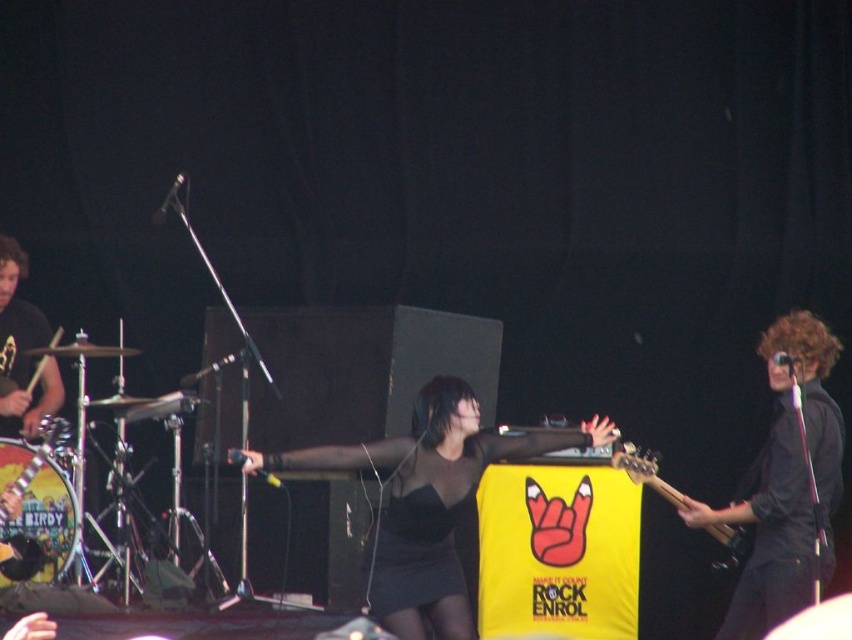
Is point (36, 513) positioned in front of point (717, 540)?

Yes, point (36, 513) is in front of point (717, 540).

Is brushed metal drum at lower left wider than wooden electric guitar at center?

In fact, brushed metal drum at lower left might be narrower than wooden electric guitar at center.

Between point (22, 456) and point (625, 460), which one is positioned behind?

The point (22, 456) is behind.

Identify the location of brushed metal drum at lower left. The image size is (852, 640). (49, 515).

Where is `brushed metal drumsticks at left`? The image size is (852, 640). brushed metal drumsticks at left is located at coordinates (22, 349).

Does brushed metal drumsticks at left have a larger size compared to wooden electric guitar at center?

Indeed, brushed metal drumsticks at left has a larger size compared to wooden electric guitar at center.

Is point (9, 307) positioned after point (746, 545)?

Yes, it is.

Find the location of a particular element. Image resolution: width=852 pixels, height=640 pixels. brushed metal drumsticks at left is located at coordinates (22, 349).

How far apart are black matte guitar at right and brushed metal drum at lower left?

They are 3.30 meters apart.

Does point (770, 470) lie behind point (73, 492)?

No, it is in front of (73, 492).

Is point (815, 444) positioned in front of point (9, 522)?

That is True.

Find the location of a particular element. This screenshot has height=640, width=852. black matte guitar at right is located at coordinates (784, 483).